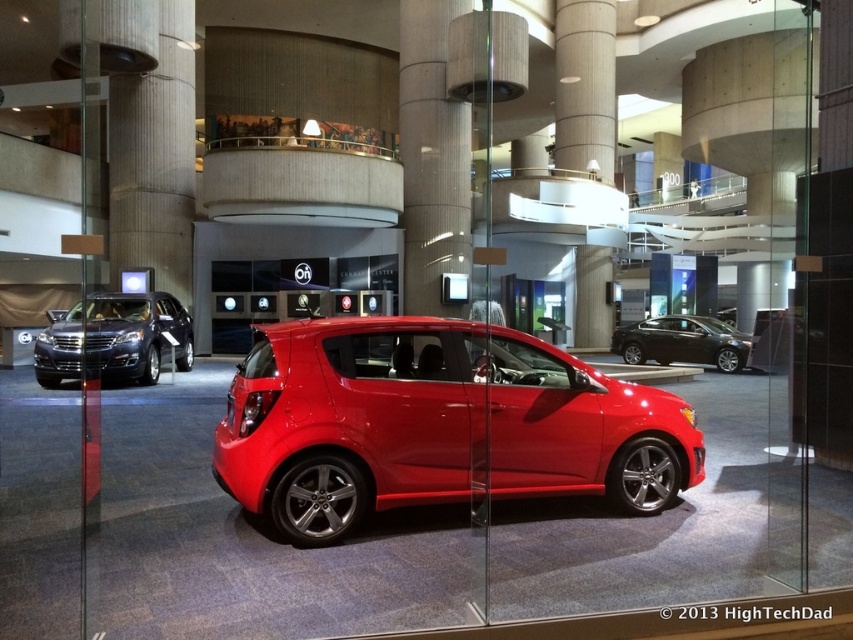
Question: Does glossy red hatchback at center appear under shiny black suv at left?

Choices:
 (A) yes
 (B) no

Answer: (A)

Question: Which object is the closest to the glossy black sedan at center?

Choices:
 (A) glossy red hatchback at center
 (B) shiny black suv at left

Answer: (A)

Question: Which is nearer to the glossy black sedan at center?

Choices:
 (A) shiny black suv at left
 (B) glossy red hatchback at center

Answer: (B)

Question: Does glossy red hatchback at center have a greater width compared to shiny black suv at left?

Choices:
 (A) yes
 (B) no

Answer: (A)

Question: Considering the relative positions of glossy red hatchback at center and shiny black suv at left in the image provided, where is glossy red hatchback at center located with respect to shiny black suv at left?

Choices:
 (A) right
 (B) left

Answer: (A)

Question: Among these points, which one is nearest to the camera?

Choices:
 (A) (187, 342)
 (B) (657, 317)
 (C) (651, 404)

Answer: (C)